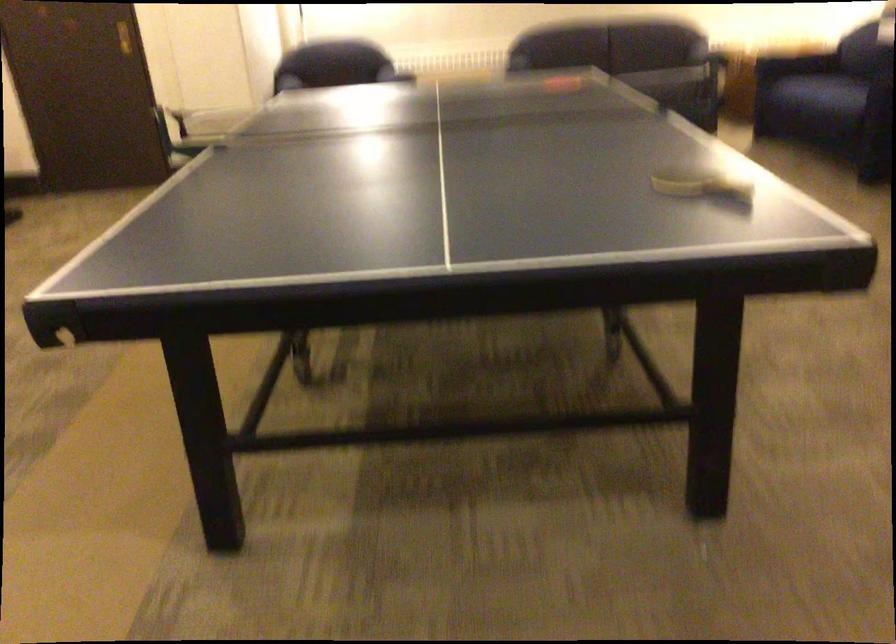
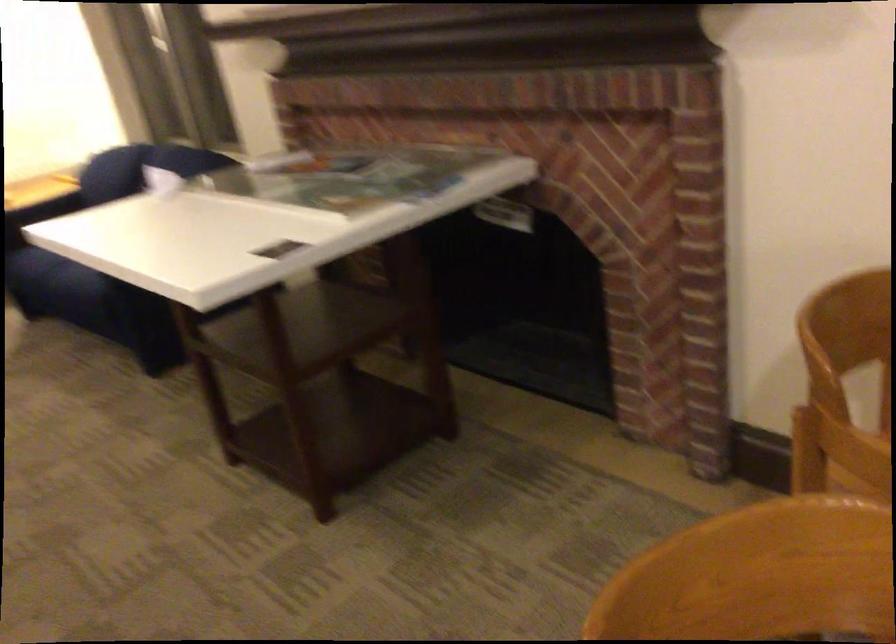
Question: I am providing you with two images of the same scene from different viewpoints. Which of the following objects are not visible in image2?

Choices:
 (A) chair sitting surface
 (B) sofa armrest
 (C) sofa sitting surface
 (D) orange soda bottle

Answer: (A)